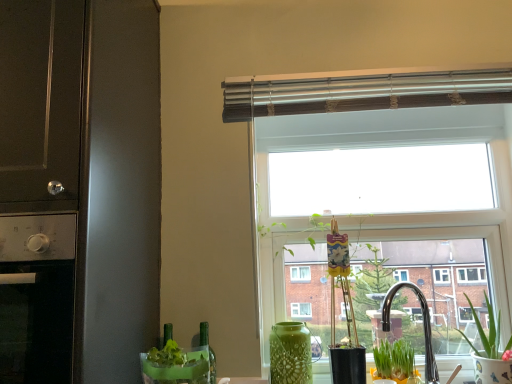
This screenshot has height=384, width=512. Identify the location of green matte plant at lower right, which is the 2th houseplant in right-to-left order. (394, 361).

Where is `stainless steel oven at left, which appears as the second appliance when viewed from the top`? stainless steel oven at left, which appears as the second appliance when viewed from the top is located at coordinates (37, 297).

What are the coordinates of `metallic blinds at upper center` in the screenshot? It's located at (362, 91).

Is green glass bottle at lower center beside transparent glass window at center?

No.

Can you confirm if green glass bottle at lower center is taller than transparent glass window at center?

No.

From the image's perspective, which one is positioned lower, green glass bottle at lower center or transparent glass window at center?

green glass bottle at lower center appears lower in the image.

Is green glass bottle at lower center looking in the opposite direction of transparent glass window at center?

No, transparent glass window at center is not at the back of green glass bottle at lower center.

From the image's perspective, who appears lower, green matte plant at lower right, which is the 2th houseplant in right-to-left order, or green textured vase at center?

From the image's view, green matte plant at lower right, which is the 2th houseplant in right-to-left order, is below.

Considering the relative positions of green matte plant at lower right, arranged as the 1th houseplant when viewed from the left, and green textured vase at center in the image provided, is green matte plant at lower right, arranged as the 1th houseplant when viewed from the left, to the left of green textured vase at center from the viewer's perspective?

No, green matte plant at lower right, arranged as the 1th houseplant when viewed from the left, is not to the left of green textured vase at center.

Is green textured vase at center at the back of green matte plant at lower right, which is the 2th houseplant in right-to-left order?

No, green matte plant at lower right, which is the 2th houseplant in right-to-left order, is not facing away from green textured vase at center.

Who is taller, green matte plant at lower right, arranged as the 1th houseplant when viewed from the left, or green textured vase at center?

green textured vase at center.

Is matte black oven at left, the second appliance positioned from the bottom, positioned with its back to green textured vase at center?

matte black oven at left, the second appliance positioned from the bottom, is not turned away from green textured vase at center.

Are matte black oven at left, placed as the first appliance when sorted from top to bottom, and green textured vase at center making contact?

They are not placed beside each other.

From the image's perspective, is matte black oven at left, placed as the first appliance when sorted from top to bottom, above green textured vase at center?

Yes, from the image's perspective, matte black oven at left, placed as the first appliance when sorted from top to bottom, is on top of green textured vase at center.

In the image, there is a metallic blinds at upper center. What are the coordinates of `window below it (from a real-world perspective)` in the screenshot? It's located at (353, 107).

From the picture: Between transparent glass window at center and metallic blinds at upper center, which one has more height?

With more height is transparent glass window at center.

Which object is closer to the camera taking this photo, transparent glass window at center or metallic blinds at upper center?

metallic blinds at upper center is in front.

Between transparent glass window at center and metallic blinds at upper center, which one has smaller width?

With smaller width is metallic blinds at upper center.

What's the angular difference between translucent green vase at lower center and green glass bottle at lower center's facing directions?

The angle between the facing direction of translucent green vase at lower center and the facing direction of green glass bottle at lower center is 0.00193 degrees.

Between translucent green vase at lower center and green glass bottle at lower center, which one has larger size?

translucent green vase at lower center.

Can you confirm if translucent green vase at lower center is positioned to the left of green glass bottle at lower center?

Yes.

Would you consider translucent green vase at lower center to be distant from green glass bottle at lower center?

No, there isn't a large distance between translucent green vase at lower center and green glass bottle at lower center.

Is metallic blinds at upper center facing away from stainless steel oven at left, the first appliance when ordered from bottom to top?

No, metallic blinds at upper center's orientation is not away from stainless steel oven at left, the first appliance when ordered from bottom to top.

Is metallic blinds at upper center at the right side of stainless steel oven at left, which appears as the second appliance when viewed from the top?

Yes.

In terms of size, does metallic blinds at upper center appear bigger or smaller than stainless steel oven at left, which appears as the second appliance when viewed from the top?

Considering their sizes, metallic blinds at upper center takes up less space than stainless steel oven at left, which appears as the second appliance when viewed from the top.

Which is in front, point (432, 92) or point (23, 221)?

The point (23, 221) is more forward.

From the image's perspective, is green ceramic pot at lower right, the 1th houseplant viewed from the right, located above green matte plant at lower right, which is the 2th houseplant in right-to-left order?

Yes, from the image's perspective, green ceramic pot at lower right, the 1th houseplant viewed from the right, is on top of green matte plant at lower right, which is the 2th houseplant in right-to-left order.

Considering the relative sizes of green ceramic pot at lower right, the 1th houseplant viewed from the right, and green matte plant at lower right, which is the 2th houseplant in right-to-left order, in the image provided, is green ceramic pot at lower right, the 1th houseplant viewed from the right, bigger than green matte plant at lower right, which is the 2th houseplant in right-to-left order,?

Indeed, green ceramic pot at lower right, the 1th houseplant viewed from the right, has a larger size compared to green matte plant at lower right, which is the 2th houseplant in right-to-left order.

Is point (492, 351) positioned in front of point (386, 344)?

That is False.

Based on their positions, is green ceramic pot at lower right, the 1th houseplant viewed from the right, located to the left or right of green matte plant at lower right, which is the 2th houseplant in right-to-left order?

Clearly, green ceramic pot at lower right, the 1th houseplant viewed from the right, is on the right of green matte plant at lower right, which is the 2th houseplant in right-to-left order, in the image.

Identify the location of bottle in front of the transparent glass window at center. This screenshot has width=512, height=384. pyautogui.click(x=209, y=349).

Locate an element on the screen. Image resolution: width=512 pixels, height=384 pixels. houseplant beneath the green textured vase at center (from a real-world perspective) is located at coordinates (394, 361).

From the picture: From the image, which object appears to be farther from green matte plant at lower right, which is the 2th houseplant in right-to-left order, translucent green vase at lower center or transparent glass window at center?

translucent green vase at lower center.

From the image, which object appears to be farther from translucent green vase at lower center, green textured vase at center or green ceramic pot at lower right, the 1th houseplant viewed from the right?

Based on the image, green ceramic pot at lower right, the 1th houseplant viewed from the right, appears to be further to translucent green vase at lower center.

Estimate the real-world distances between objects in this image. Which object is closer to translucent green vase at lower center, green textured vase at center or transparent glass window at center?

green textured vase at center is positioned closer to the anchor translucent green vase at lower center.

Estimate the real-world distances between objects in this image. Which object is closer to green matte plant at lower right, arranged as the 1th houseplant when viewed from the left, green glass bottle at lower center or transparent glass window at center?

green glass bottle at lower center is closer to green matte plant at lower right, arranged as the 1th houseplant when viewed from the left.

Based on their spatial positions, is green textured vase at center or transparent glass window at center closer to green glass bottle at lower center?

green textured vase at center is positioned closer to the anchor green glass bottle at lower center.

From the image, which object appears to be nearer to green ceramic pot at lower right, the 1th houseplant viewed from the right, transparent glass window at center or green glass bottle at lower center?

Based on the image, transparent glass window at center appears to be nearer to green ceramic pot at lower right, the 1th houseplant viewed from the right.

When comparing their distances from green glass bottle at lower center, does translucent green vase at lower center or matte black oven at left, the second appliance positioned from the bottom, seem further?

The object further to green glass bottle at lower center is matte black oven at left, the second appliance positioned from the bottom.

From the image, which object appears to be farther from matte black oven at left, placed as the first appliance when sorted from top to bottom, transparent glass window at center or green glass bottle at lower center?

green glass bottle at lower center is positioned further to the anchor matte black oven at left, placed as the first appliance when sorted from top to bottom.

Locate an element on the screen. The width and height of the screenshot is (512, 384). vase between green glass bottle at lower center and transparent glass window at center in the horizontal direction is located at coordinates (290, 353).

This screenshot has width=512, height=384. Identify the location of bottle located between stainless steel oven at left, which appears as the second appliance when viewed from the top, and green matte plant at lower right, arranged as the 1th houseplant when viewed from the left, in the left-right direction. (209, 349).

The height and width of the screenshot is (384, 512). In order to click on plant located between stainless steel oven at left, the first appliance when ordered from bottom to top, and green glass bottle at lower center in the depth direction in this screenshot , I will do `click(175, 365)`.

Where is `appliance situated between matte black oven at left, the second appliance positioned from the bottom, and translucent green vase at lower center from left to right`? The image size is (512, 384). appliance situated between matte black oven at left, the second appliance positioned from the bottom, and translucent green vase at lower center from left to right is located at coordinates (37, 297).